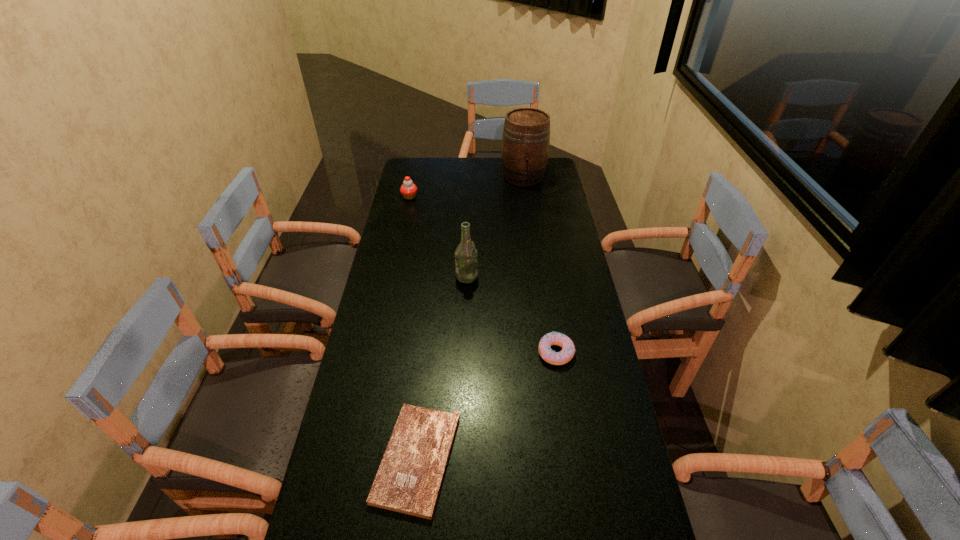
Identify the location of vacant space positioned 0.090m on the side of the cider near the bung hole. (x=527, y=200).

This screenshot has width=960, height=540. Identify the location of vacant space located on the surface of the beer bottle. (558, 276).

Find the location of a particular element. This screenshot has height=540, width=960. free region located 0.300m on the front of the second farthest object is located at coordinates (399, 245).

Locate an element on the screen. vacant space positioned 0.060m on the front of the second nearest object is located at coordinates (562, 386).

Locate an element on the screen. The image size is (960, 540). vacant region located 0.150m on the back of the Bible is located at coordinates (427, 361).

Where is `object that is at the far edge`? The image size is (960, 540). object that is at the far edge is located at coordinates (526, 135).

At what (x,y) coordinates should I click in order to perform the action: click on cupcake at the left edge. Please return your answer as a coordinate pair (x, y). The height and width of the screenshot is (540, 960). Looking at the image, I should click on (408, 189).

Where is `Bible located at the left edge`? This screenshot has height=540, width=960. Bible located at the left edge is located at coordinates (409, 478).

The image size is (960, 540). I want to click on cider present at the right edge, so click(526, 135).

I want to click on doughnut that is at the right edge, so click(547, 354).